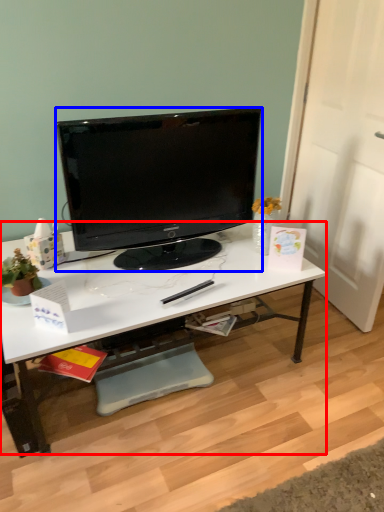
Question: Which point is further to the camera, desk (highlighted by a red box) or television (highlighted by a blue box)?

Choices:
 (A) desk
 (B) television

Answer: (B)